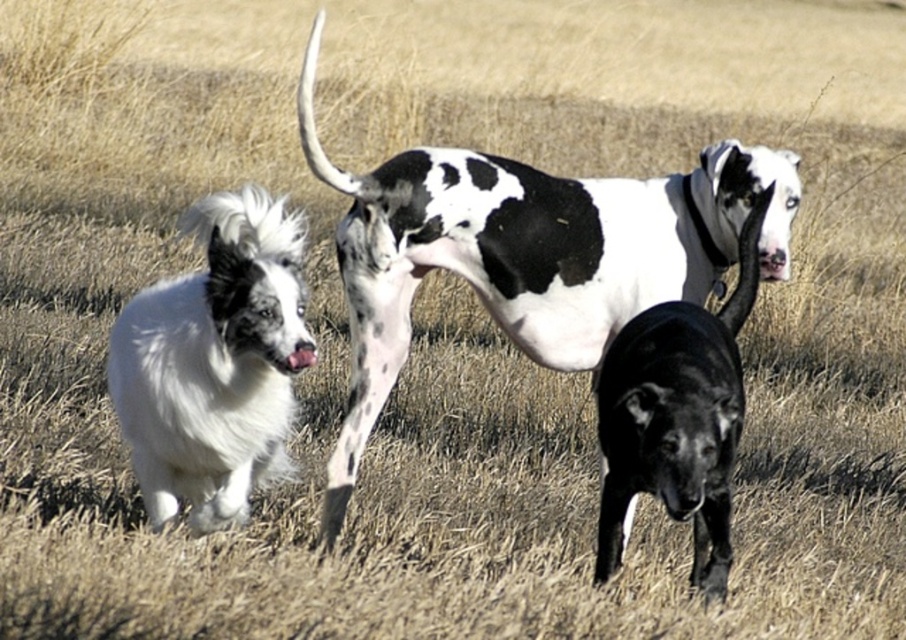
Can you confirm if black and white spotted coat at center is taller than black glossy dog at center?

Indeed, black and white spotted coat at center has a greater height compared to black glossy dog at center.

Does black and white spotted coat at center lie in front of black glossy dog at center?

No, it is not.

The image size is (906, 640). In order to click on black and white spotted coat at center in this screenshot , I will do `click(527, 252)`.

Find the location of a particular element. The width and height of the screenshot is (906, 640). black and white spotted coat at center is located at coordinates (527, 252).

Is the position of black and white spotted coat at center more distant than that of white fluffy dog at left?

Yes, it is behind white fluffy dog at left.

Image resolution: width=906 pixels, height=640 pixels. What do you see at coordinates (527, 252) in the screenshot? I see `black and white spotted coat at center` at bounding box center [527, 252].

Where is `black and white spotted coat at center`? black and white spotted coat at center is located at coordinates (527, 252).

Between white fluffy dog at left and black glossy dog at center, which one appears on the right side from the viewer's perspective?

Positioned to the right is black glossy dog at center.

Between point (259, 381) and point (699, 417), which one is positioned in front?

Point (699, 417)

You are a GUI agent. You are given a task and a screenshot of the screen. Output one action in this format:
    pyautogui.click(x=<x>, y=<y>)
    Task: Click on the white fluffy dog at left
    The image size is (906, 640).
    Given the screenshot: What is the action you would take?
    pyautogui.click(x=215, y=362)